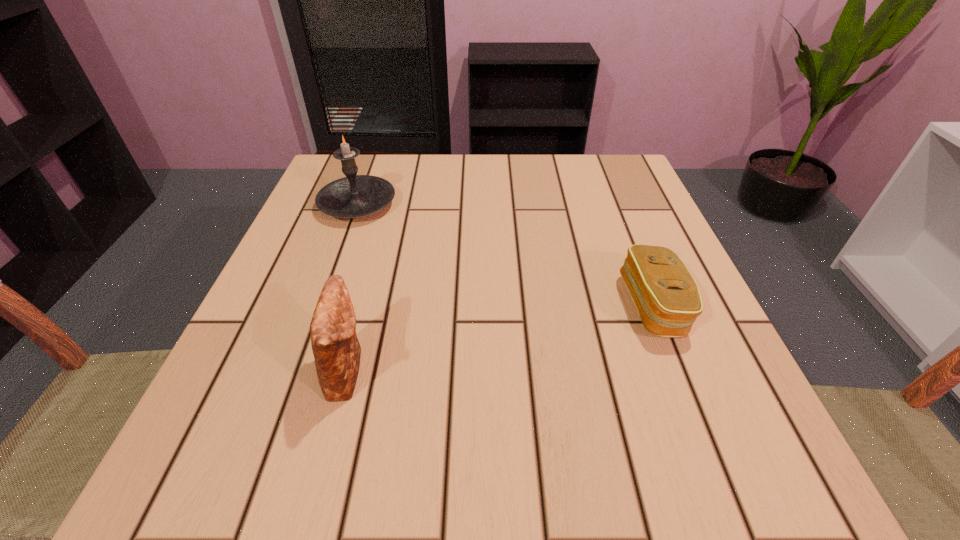
Identify the location of object that is positioned at the far edge. (353, 196).

Locate an element on the screen. The height and width of the screenshot is (540, 960). candle that is positioned at the left edge is located at coordinates (353, 196).

This screenshot has height=540, width=960. In order to click on clutch bag that is at the left edge in this screenshot , I will do `click(336, 349)`.

The height and width of the screenshot is (540, 960). Find the location of `object that is at the right edge`. object that is at the right edge is located at coordinates (667, 298).

Locate an element on the screen. The width and height of the screenshot is (960, 540). object present at the far left corner is located at coordinates (353, 196).

This screenshot has width=960, height=540. Find the location of `vacant position at the far edge of the desktop`. vacant position at the far edge of the desktop is located at coordinates (492, 155).

In the image, there is a desktop. Identify the location of vacant space at the near edge. This screenshot has width=960, height=540. (632, 442).

This screenshot has width=960, height=540. In the image, there is a desktop. Identify the location of vacant space at the right edge. (615, 238).

This screenshot has width=960, height=540. Find the location of `vacant point at the far left corner`. vacant point at the far left corner is located at coordinates (341, 171).

At what (x,y) coordinates should I click in order to perform the action: click on vacant area at the near left corner of the desktop. Please return your answer as a coordinate pair (x, y). Looking at the image, I should click on (312, 436).